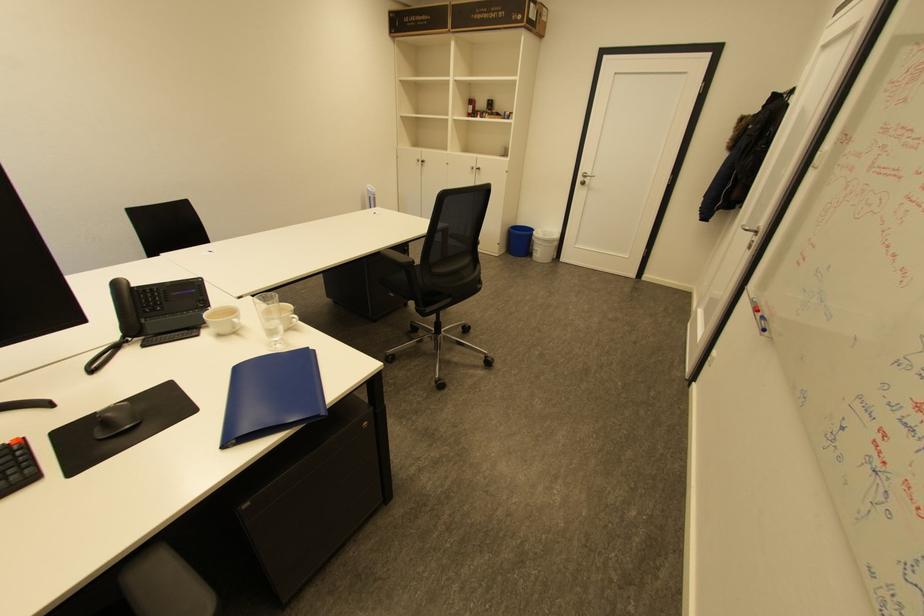
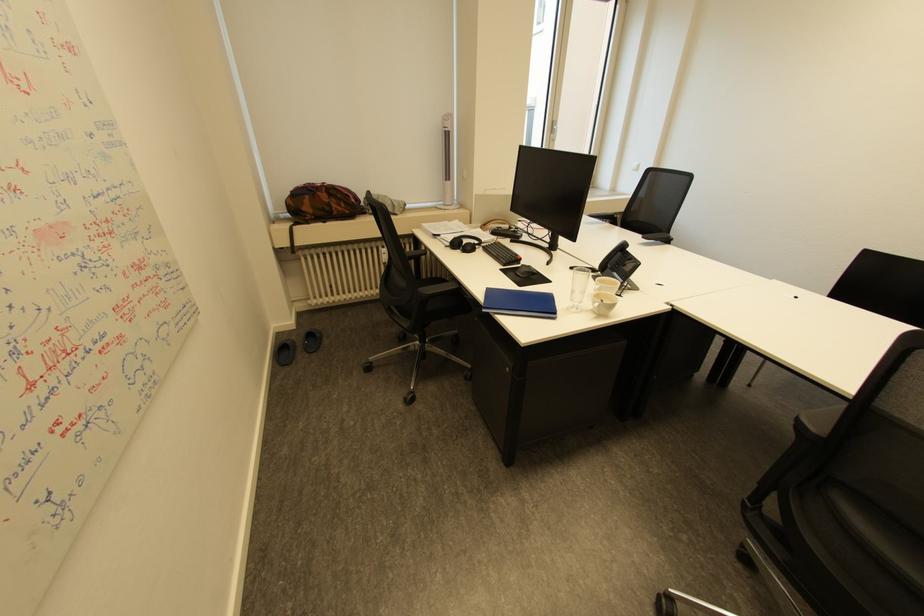
In the second image, find the point that corresponds to pixel 150 320 in the first image.

(616, 267)